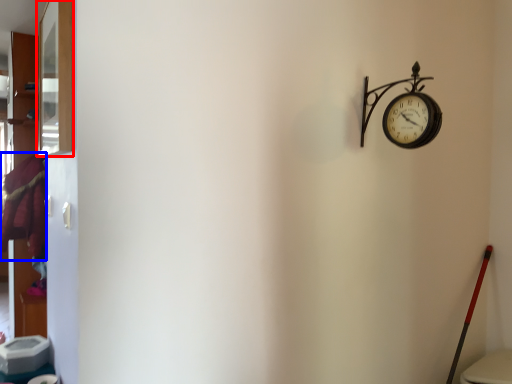
Question: Which point is further to the camera, window (highlighted by a red box) or laundry (highlighted by a blue box)?

Choices:
 (A) window
 (B) laundry

Answer: (B)